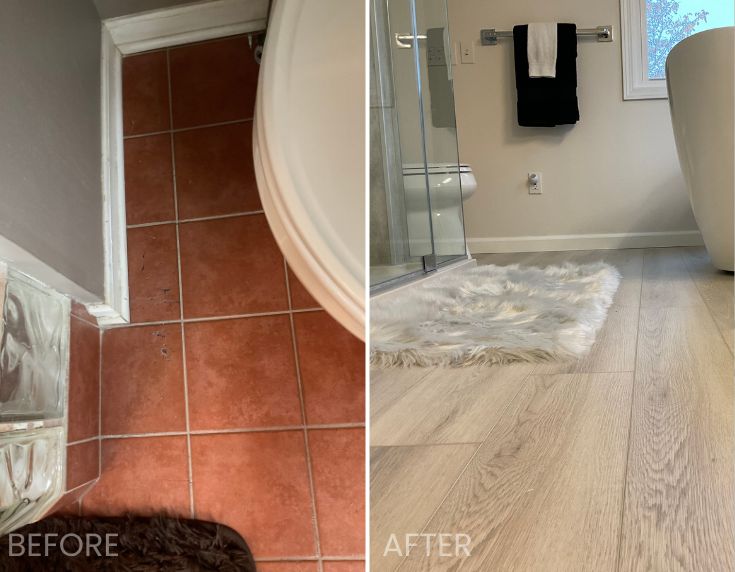
Identify the location of switch. The height and width of the screenshot is (572, 735). (467, 53), (441, 57).